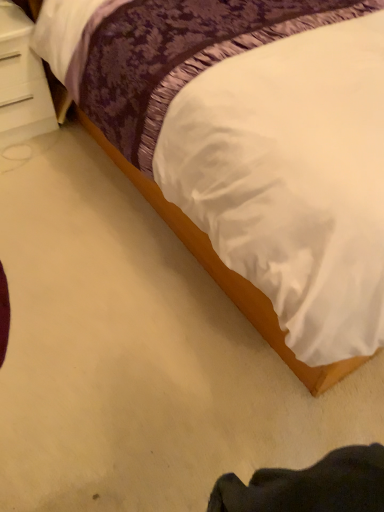
Where is `white glossy nightstand at left`? Image resolution: width=384 pixels, height=512 pixels. white glossy nightstand at left is located at coordinates (21, 81).

This screenshot has height=512, width=384. What do you see at coordinates (21, 81) in the screenshot?
I see `white glossy nightstand at left` at bounding box center [21, 81].

At what (x,y) coordinates should I click in order to perform the action: click on white glossy nightstand at left. Please return your answer as a coordinate pair (x, y). This screenshot has height=512, width=384. Looking at the image, I should click on (21, 81).